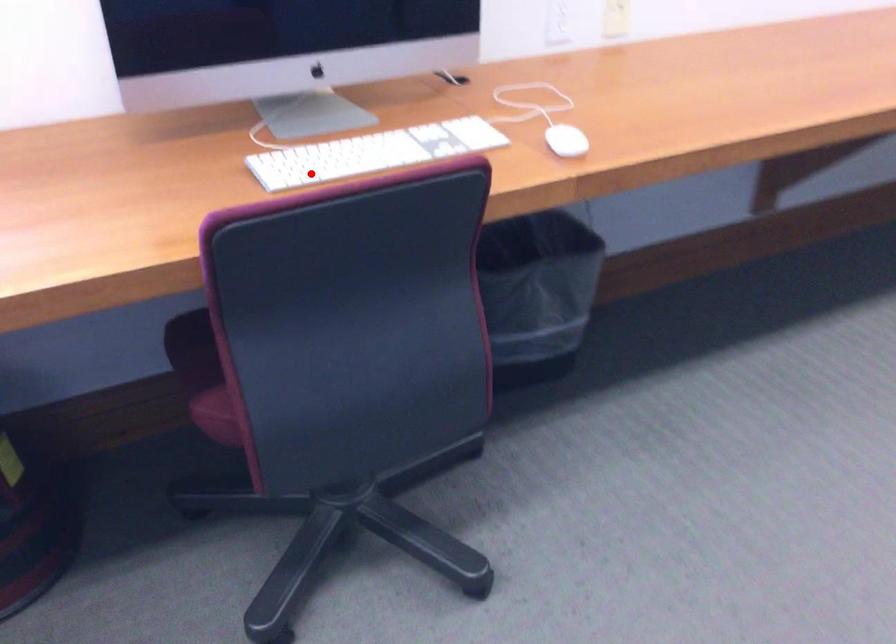
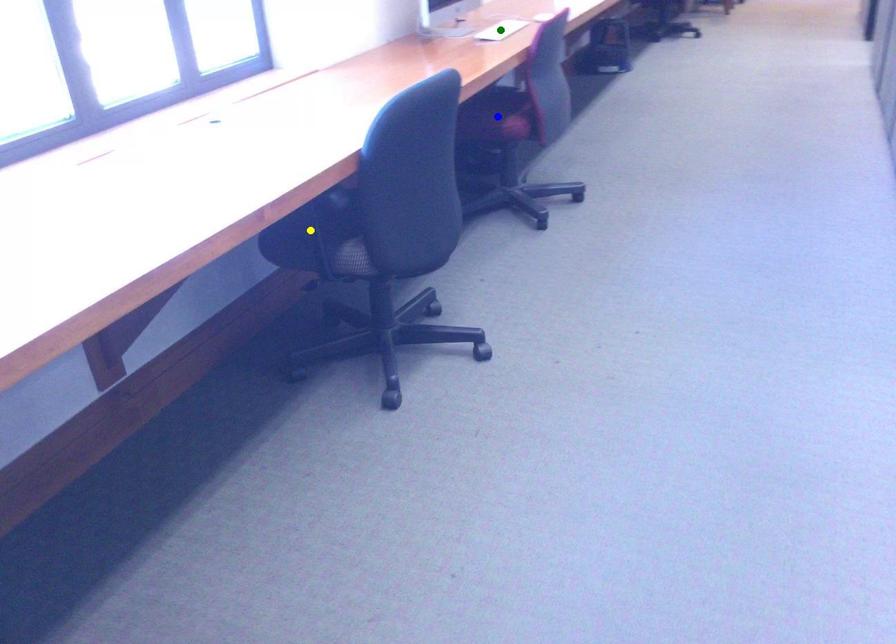
Question: I am providing you with two images of the same scene from different viewpoints. A red point is marked on the first image. You are given multiple points on the second image. Can you choose the point in image 2 that corresponds to the point in image 1?

Choices:
 (A) blue point
 (B) green point
 (C) yellow point

Answer: (B)